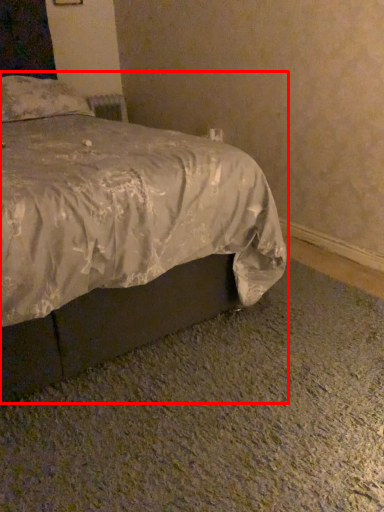
Question: From the image's perspective, considering the relative positions of bed (annotated by the red box) and pillow in the image provided, where is bed (annotated by the red box) located with respect to the staircase?

Choices:
 (A) below
 (B) above

Answer: (A)